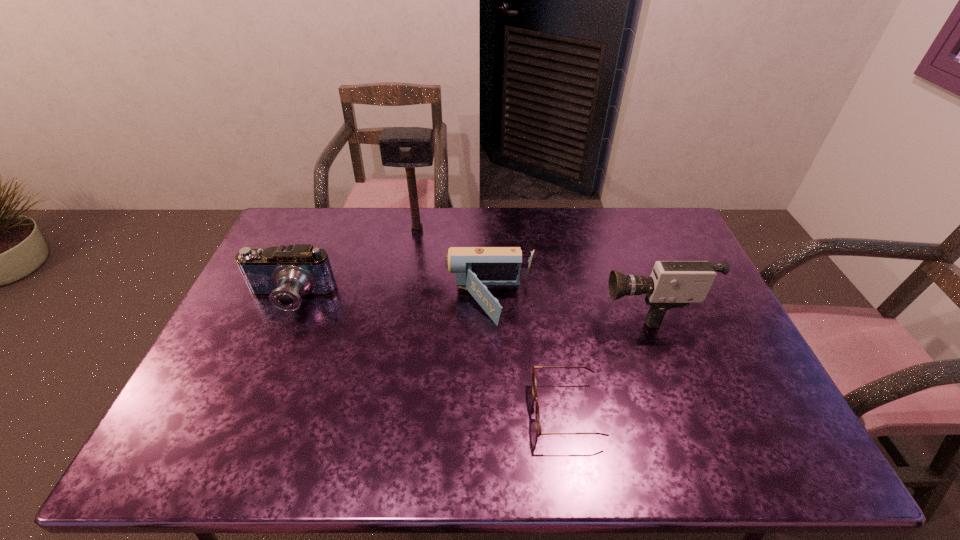
Locate an element on the screen. the farthest object is located at coordinates (409, 147).

In order to click on mallet in this screenshot , I will do `click(409, 147)`.

Find the location of a particular element. the fourth shortest object is located at coordinates (672, 284).

You are a GUI agent. You are given a task and a screenshot of the screen. Output one action in this format:
    pyautogui.click(x=<x>, y=<y>)
    Task: Click on the rightmost camcorder
    Image resolution: width=960 pixels, height=540 pixels.
    Given the screenshot: What is the action you would take?
    pyautogui.click(x=672, y=284)

Locate an element on the screen. This screenshot has height=540, width=960. the leftmost camcorder is located at coordinates (284, 273).

Find the location of a particular element. the second camcorder from right to left is located at coordinates (476, 268).

Identify the location of the shortest object. The width and height of the screenshot is (960, 540). (534, 387).

This screenshot has height=540, width=960. What are the coordinates of `spectacles` in the screenshot? It's located at (534, 387).

You are a GUI agent. You are given a task and a screenshot of the screen. Output one action in this format:
    pyautogui.click(x=<x>, y=<y>)
    Task: Click on the vacant area situated 0.400m on the right of the mallet
    This screenshot has width=960, height=540.
    Given the screenshot: What is the action you would take?
    pyautogui.click(x=549, y=231)

Find the location of a particular element. This screenshot has height=540, width=960. free space located on the recording direction of the rightmost camcorder is located at coordinates (515, 307).